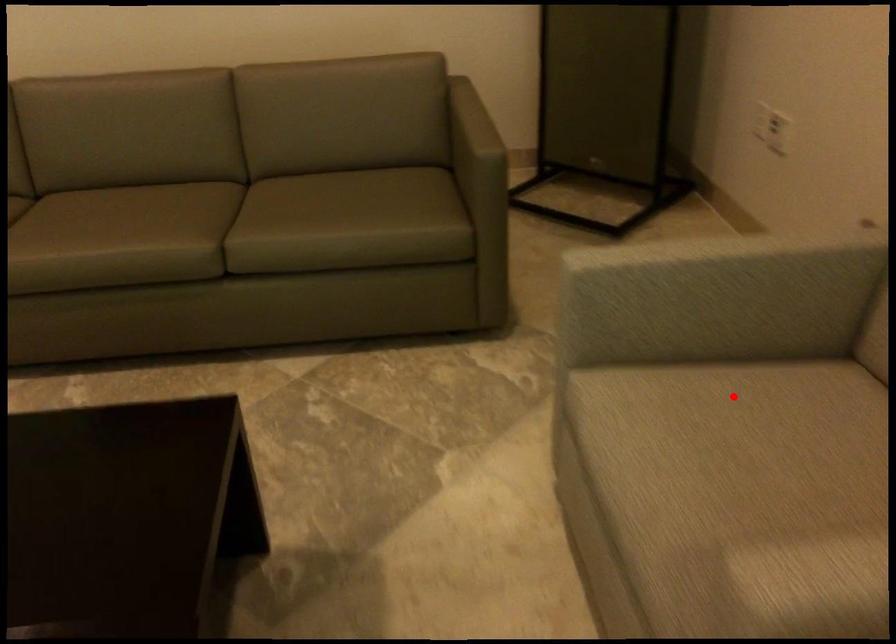
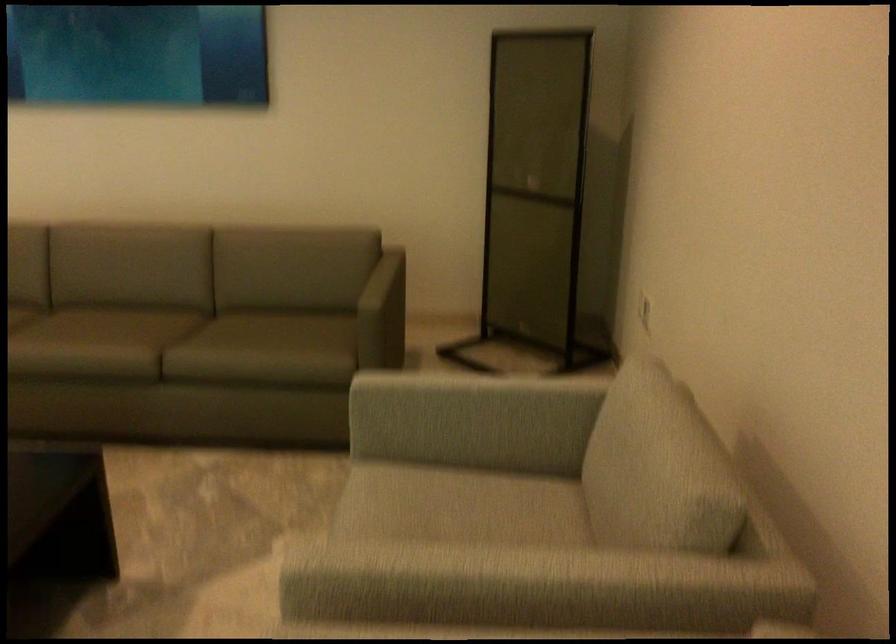
Find the pixel in the second image that matches the highlighted location in the first image.

(455, 491)